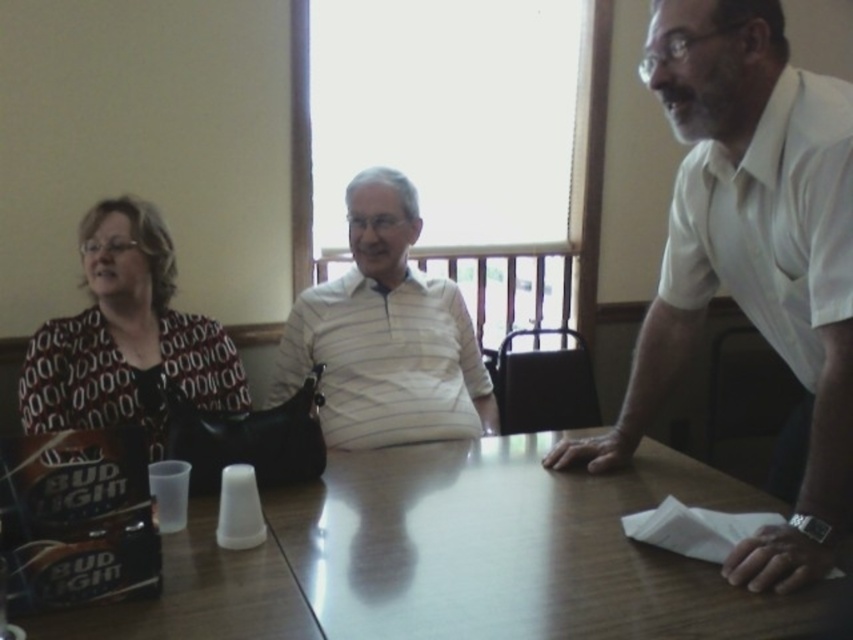
You are a photographer setting up a shoot in the room. You need to position a light source so that it illuminates both the white striped polo shirt at center and the printed fabric blouse at left. Based on their positions, which direction should the light come from to ensure both are well lit?

The white striped polo shirt at center is above the printed fabric blouse at left, so positioning the light source from below would illuminate both effectively.